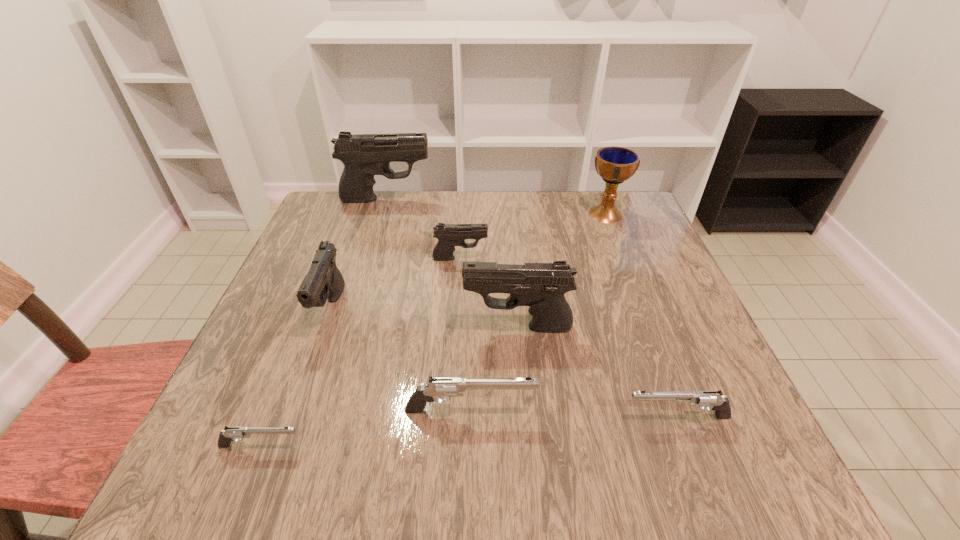
Find the location of `the sixth tallest pistol`. the sixth tallest pistol is located at coordinates (713, 399).

In order to click on the nearest pistol in this screenshot , I will do `click(230, 434)`.

Where is `the shortest object`? the shortest object is located at coordinates (230, 434).

Find the location of a particular element. The width and height of the screenshot is (960, 540). vacant point located at the barrel of the biggest black pistol is located at coordinates (476, 199).

This screenshot has height=540, width=960. I want to click on vacant space situated 0.400m on the left of the blue chalice, so click(443, 214).

You are a GUI agent. You are given a task and a screenshot of the screen. Output one action in this format:
    pyautogui.click(x=<x>, y=<y>)
    Task: Click on the vacant area situated at the barrel of the second biggest black pistol
    The height and width of the screenshot is (540, 960).
    Given the screenshot: What is the action you would take?
    pyautogui.click(x=353, y=327)

Find the location of a particular element. Image resolution: width=960 pixels, height=540 pixels. vacant space located at the barrel of the second biggest black pistol is located at coordinates (363, 327).

Where is `vacant area situated at the barrel of the second biggest black pistol`? The width and height of the screenshot is (960, 540). vacant area situated at the barrel of the second biggest black pistol is located at coordinates (420, 327).

The height and width of the screenshot is (540, 960). I want to click on free space located at the barrel of the second smallest black pistol, so 309,369.

Identify the location of free space located 0.170m at the barrel of the second farthest black pistol. (557, 258).